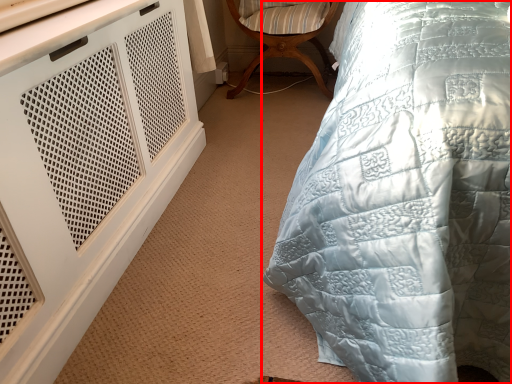
Question: From the image, what is the correct spatial relationship of bed (annotated by the red box) in relation to chair?

Choices:
 (A) left
 (B) right

Answer: (B)